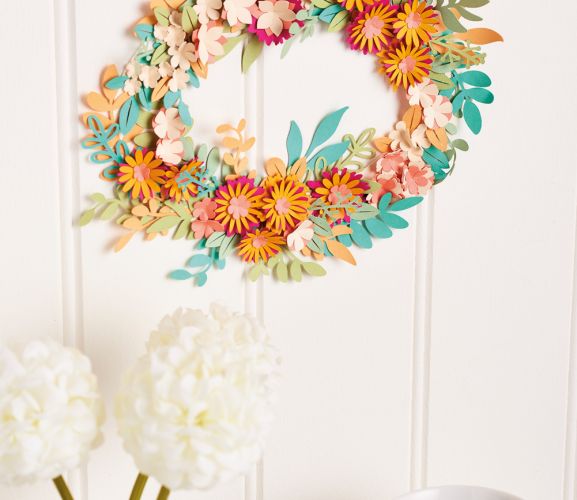
At what (x,y) coordinates should I click in order to perform the action: click on vase. Please return your answer as a coordinate pair (x, y). This screenshot has width=577, height=500. Looking at the image, I should click on [449, 490].